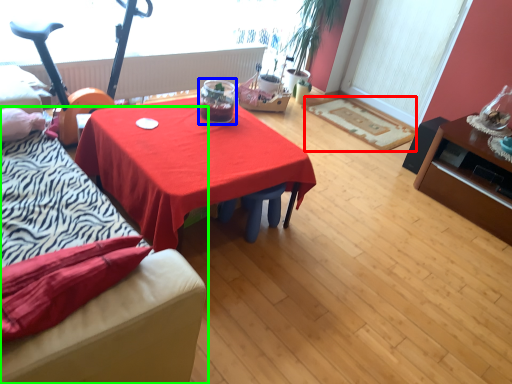
Question: Considering the real-world distances, which object is closest to mat (highlighted by a red box)? glass jar (highlighted by a blue box) or studio couch (highlighted by a green box).

Choices:
 (A) glass jar
 (B) studio couch

Answer: (A)